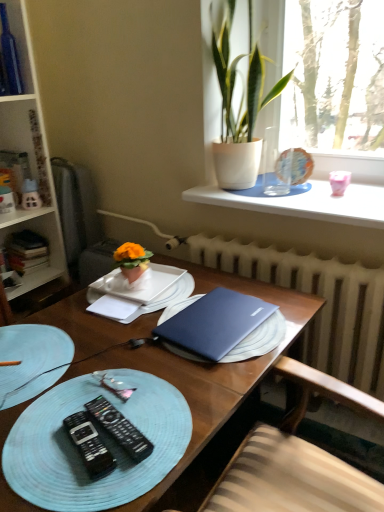
The height and width of the screenshot is (512, 384). Identify the location of vacant space to the right of matte glass globe at upper right, which is counted as the 1th tableware, starting from the right. (329, 184).